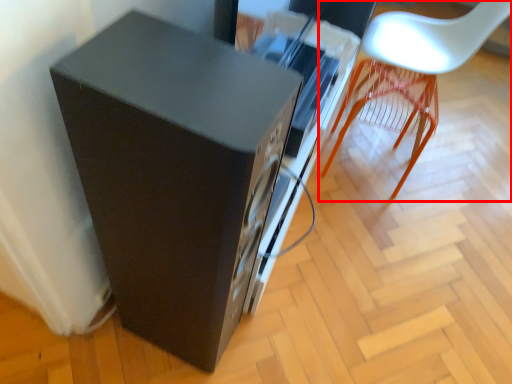
Question: From the image's perspective, what is the correct spatial relationship of chair (annotated by the red box) in relation to furniture?

Choices:
 (A) below
 (B) above

Answer: (B)